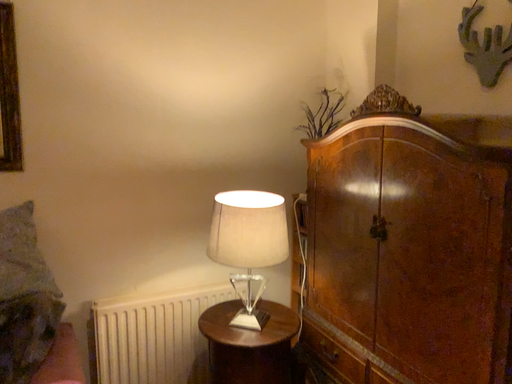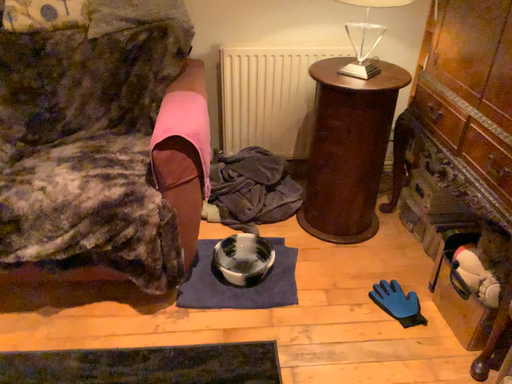
Question: Which way did the camera rotate in the video?

Choices:
 (A) rotated upward
 (B) rotated downward

Answer: (B)